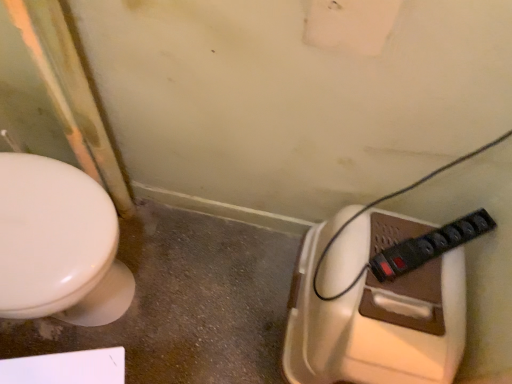
Question: Is black plastic power strip at lower right bigger than brown plastic toilet at lower right?

Choices:
 (A) no
 (B) yes

Answer: (A)

Question: Is brown plastic toilet at lower right a part of black plastic power strip at lower right?

Choices:
 (A) no
 (B) yes

Answer: (A)

Question: From a real-world perspective, is black plastic power strip at lower right located higher than brown plastic toilet at lower right?

Choices:
 (A) no
 (B) yes

Answer: (B)

Question: Does black plastic power strip at lower right have a lesser height compared to brown plastic toilet at lower right?

Choices:
 (A) yes
 (B) no

Answer: (A)

Question: Is black plastic power strip at lower right outside brown plastic toilet at lower right?

Choices:
 (A) no
 (B) yes

Answer: (B)

Question: Is black plastic power strip at lower right further to the viewer compared to brown plastic toilet at lower right?

Choices:
 (A) yes
 (B) no

Answer: (A)

Question: Is brown plastic toilet at lower right behind black plastic power strip at lower right?

Choices:
 (A) yes
 (B) no

Answer: (B)

Question: From a real-world perspective, is brown plastic toilet at lower right physically above black plastic power strip at lower right?

Choices:
 (A) yes
 (B) no

Answer: (B)

Question: From the image's perspective, is brown plastic toilet at lower right located beneath black plastic power strip at lower right?

Choices:
 (A) yes
 (B) no

Answer: (A)

Question: Is the depth of brown plastic toilet at lower right less than that of black plastic power strip at lower right?

Choices:
 (A) yes
 (B) no

Answer: (A)

Question: Is brown plastic toilet at lower right not inside black plastic power strip at lower right?

Choices:
 (A) yes
 (B) no

Answer: (A)

Question: Is brown plastic toilet at lower right at the left side of black plastic power strip at lower right?

Choices:
 (A) no
 (B) yes

Answer: (B)

Question: Considering the positions of black plastic power strip at lower right and brown plastic toilet at lower right in the image, is black plastic power strip at lower right wider or thinner than brown plastic toilet at lower right?

Choices:
 (A) wide
 (B) thin

Answer: (B)